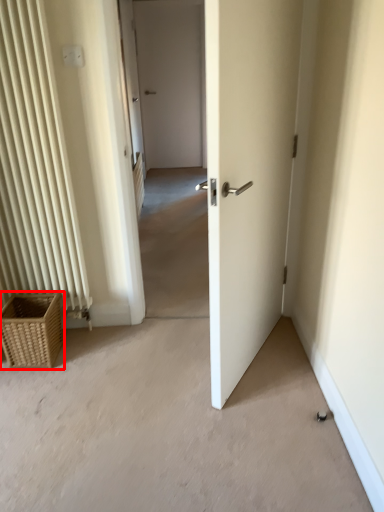
Question: From the image's perspective, considering the relative positions of picnic basket (annotated by the red box) and electric outlet in the image provided, where is picnic basket (annotated by the red box) located with respect to the staircase?

Choices:
 (A) above
 (B) below

Answer: (B)